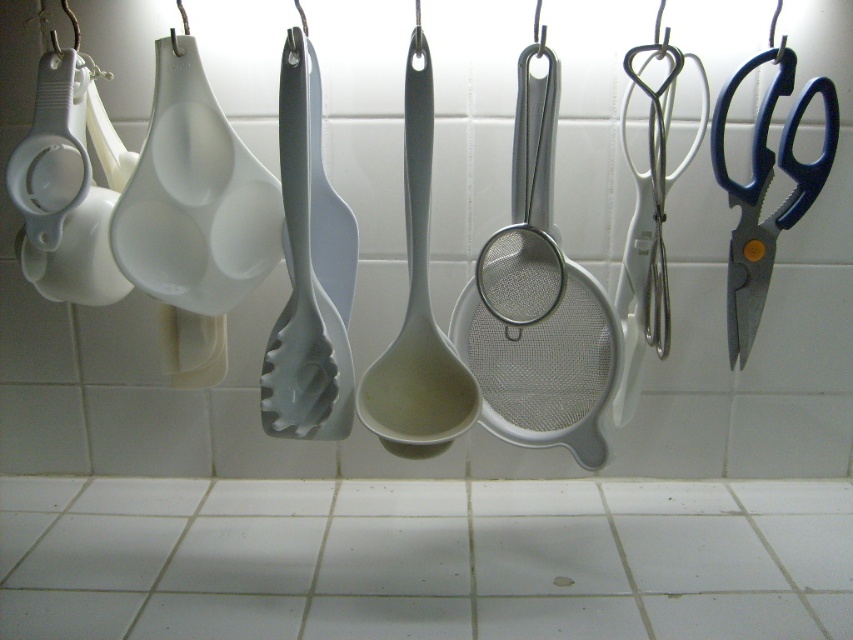
Can you confirm if gray matte pasta server at center is thinner than gray matte ladle at center?

Yes.

Does gray matte pasta server at center have a larger size compared to gray matte ladle at center?

No.

At what (x,y) coordinates should I click in order to perform the action: click on gray matte pasta server at center. Please return your answer as a coordinate pair (x, y). Looking at the image, I should click on (308, 272).

Which of these two, gray matte ladle at center or blue plastic scissors at right, stands shorter?

With less height is blue plastic scissors at right.

Is point (448, 436) behind point (825, 104)?

That is False.

Based on the photo, who is more forward, (386, 444) or (757, 237)?

Positioned in front is point (386, 444).

The image size is (853, 640). I want to click on gray matte ladle at center, so click(416, 308).

Is gray matte pasta server at center smaller than blue plastic scissors at right?

Incorrect, gray matte pasta server at center is not smaller in size than blue plastic scissors at right.

Does gray matte pasta server at center appear on the left side of blue plastic scissors at right?

Correct, you'll find gray matte pasta server at center to the left of blue plastic scissors at right.

Where is `gray matte pasta server at center`? The width and height of the screenshot is (853, 640). gray matte pasta server at center is located at coordinates (308, 272).

Find the location of a particular element. This screenshot has width=853, height=640. gray matte pasta server at center is located at coordinates (308, 272).